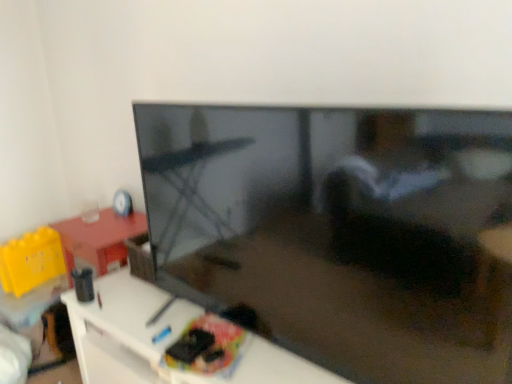
Question: From a real-world perspective, is white glossy tv stand at lower left above or below matte black tv at center?

Choices:
 (A) below
 (B) above

Answer: (A)

Question: Considering the positions of point 106,301 and point 263,201, is point 106,301 closer or farther from the camera than point 263,201?

Choices:
 (A) farther
 (B) closer

Answer: (A)

Question: Which object is the farthest from the matte black tv at center?

Choices:
 (A) matte plastic cd at upper left
 (B) white glossy tv stand at lower left

Answer: (A)

Question: Estimate the real-world distances between objects in this image. Which object is closer to the white glossy tv stand at lower left?

Choices:
 (A) matte plastic cd at upper left
 (B) matte black tv at center

Answer: (B)